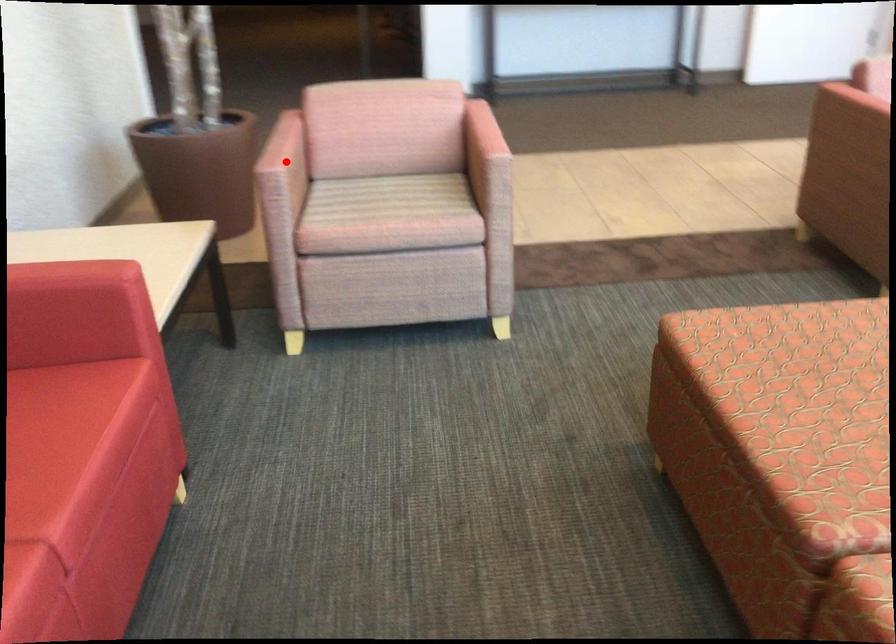
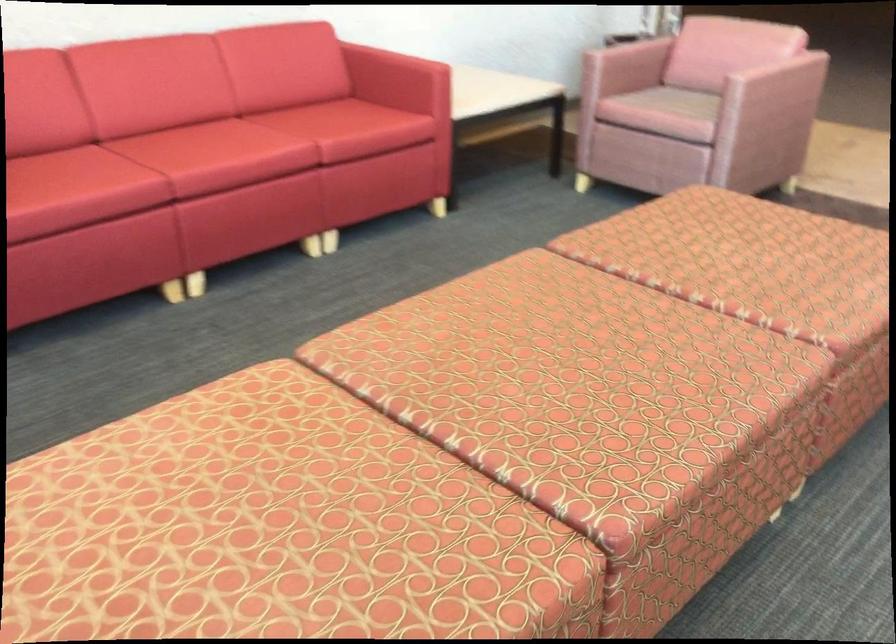
Locate, in the second image, the point that corresponds to the highlighted location in the first image.

(627, 58)